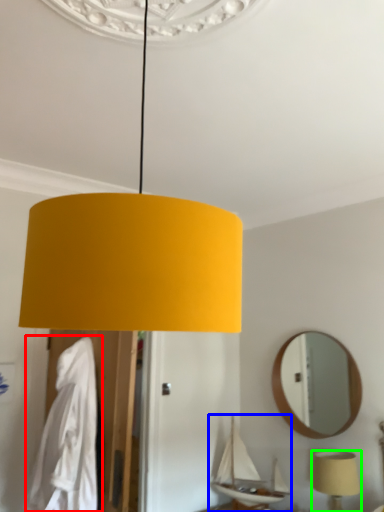
Question: Which object is the farthest from robe (highlighted by a red box)? Choose among these: boat (highlighted by a blue box) or lamp (highlighted by a green box).

Choices:
 (A) boat
 (B) lamp

Answer: (B)